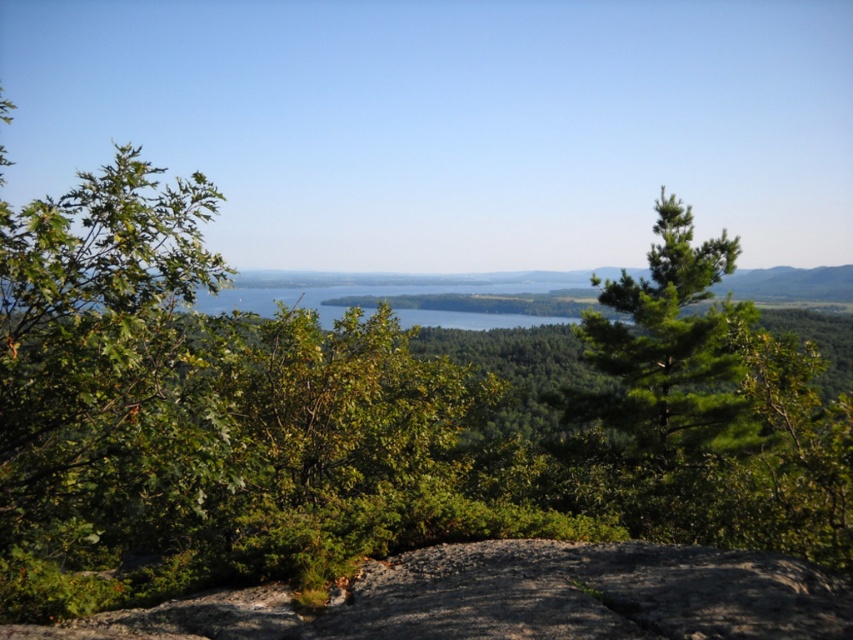
Who is lower down, gray rough rock at center or green needle-like at center?

gray rough rock at center is lower down.

Does gray rough rock at center appear on the left side of green needle-like at center?

Indeed, gray rough rock at center is positioned on the left side of green needle-like at center.

Which is behind, point (339, 595) or point (642, 420)?

Positioned behind is point (642, 420).

You are a GUI agent. You are given a task and a screenshot of the screen. Output one action in this format:
    pyautogui.click(x=<x>, y=<y>)
    Task: Click on the gray rough rock at center
    
    Given the screenshot: What is the action you would take?
    pyautogui.click(x=514, y=598)